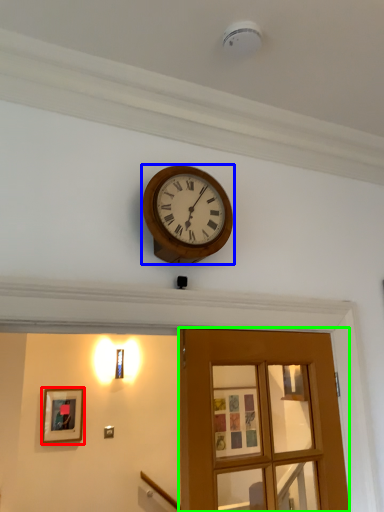
Question: Which object is the farthest from picture frame (highlighted by a red box)? Choose among these: wall clock (highlighted by a blue box) or door (highlighted by a green box).

Choices:
 (A) wall clock
 (B) door

Answer: (A)